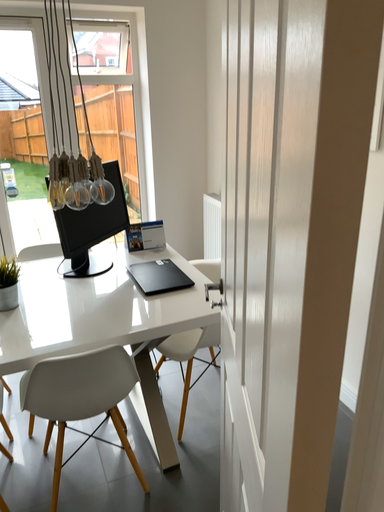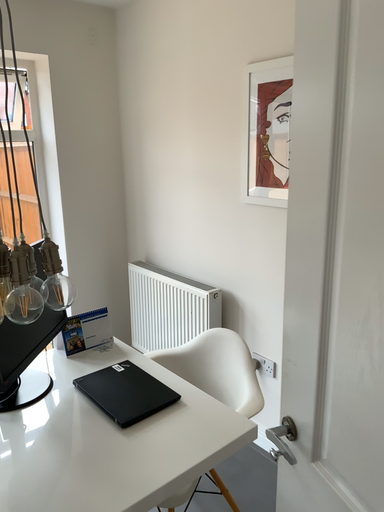
Question: How did the camera likely rotate when shooting the video?

Choices:
 (A) rotated downward
 (B) rotated upward

Answer: (B)